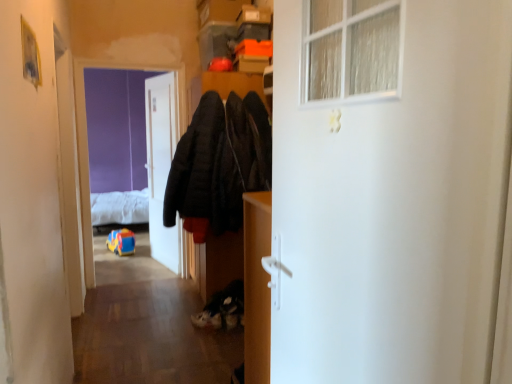
The height and width of the screenshot is (384, 512). Describe the element at coordinates (117, 129) in the screenshot. I see `purple matte screen door at upper left` at that location.

The height and width of the screenshot is (384, 512). I want to click on dark matte coat at center, so click(216, 165).

Locate an element on the screen. This screenshot has height=384, width=512. white glossy door at center, which ranks as the second door in front-to-back order is located at coordinates (161, 167).

What is the approximate width of white matte door at center, which is the first door in right-to-left order?

1.98 inches.

Find the location of a particular element. This screenshot has width=512, height=384. white matte door at center, the first door from the front is located at coordinates (393, 205).

Locate an element on the screen. The image size is (512, 384). wooden floor at lower center is located at coordinates (147, 326).

Is the depth of purple matte screen door at upper left greater than that of white matte door at center, which is the first door in right-to-left order?

Yes, purple matte screen door at upper left is behind white matte door at center, which is the first door in right-to-left order.

Is purple matte screen door at upper left turned away from white matte door at center, the second door from the left?

purple matte screen door at upper left does not have its back to white matte door at center, the second door from the left.

Would you say purple matte screen door at upper left contains white matte door at center, the first door from the front?

Actually, white matte door at center, the first door from the front, is outside purple matte screen door at upper left.

From their relative heights in the image, would you say purple matte screen door at upper left is taller or shorter than white matte door at center, acting as the 2th door starting from the back?

purple matte screen door at upper left is taller than white matte door at center, acting as the 2th door starting from the back.

Does white fluffy bed at upper left contain white glossy door at center, which is the 1th door in left-to-right order?

No, white fluffy bed at upper left does not contain white glossy door at center, which is the 1th door in left-to-right order.

From the image's perspective, is white fluffy bed at upper left on white glossy door at center, which ranks as the 1th door in back-to-front order?

No.

Consider the image. Is white fluffy bed at upper left next to white glossy door at center, which ranks as the 1th door in back-to-front order, and touching it?

white fluffy bed at upper left and white glossy door at center, which ranks as the 1th door in back-to-front order, are clearly separated.

From a real-world perspective, which object rests below the other?

white fluffy bed at upper left is physically lower.

Which object is wider, dark matte coat at center or white fluffy bed at upper left?

Wider between the two is white fluffy bed at upper left.

Which of these two, dark matte coat at center or white fluffy bed at upper left, stands taller?

Standing taller between the two is dark matte coat at center.

Can you tell me how much dark matte coat at center and white fluffy bed at upper left differ in facing direction?

They differ by 1.5 degrees in their facing directions.

From the image's perspective, does wooden floor at lower center appear higher than matte wood cabinet at center?

No, from the image's perspective, wooden floor at lower center is not over matte wood cabinet at center.

The height and width of the screenshot is (384, 512). There is a wooden floor at lower center. What are the coordinates of `cabinetry above it (from a real-world perspective)` in the screenshot? It's located at (257, 287).

How many degrees apart are the facing directions of wooden floor at lower center and matte wood cabinet at center?

The angular difference between wooden floor at lower center and matte wood cabinet at center is 91.7 degrees.

From the picture: Considering the sizes of wooden floor at lower center and matte wood cabinet at center in the image, is wooden floor at lower center bigger or smaller than matte wood cabinet at center?

In the image, wooden floor at lower center appears to be larger than matte wood cabinet at center.

Considering the sizes of objects white suede shoe at lower center and purple matte screen door at upper left in the image provided, who is smaller, white suede shoe at lower center or purple matte screen door at upper left?

With smaller size is white suede shoe at lower center.

Between white suede shoe at lower center and purple matte screen door at upper left, which one has more height?

Standing taller between the two is purple matte screen door at upper left.

Is purple matte screen door at upper left at the back of white suede shoe at lower center?

white suede shoe at lower center is not turned away from purple matte screen door at upper left.

Between white suede shoe at lower center and purple matte screen door at upper left, which one appears on the right side from the viewer's perspective?

From the viewer's perspective, white suede shoe at lower center appears more on the right side.

Considering the relative positions of purple matte screen door at upper left and dark matte coat at center in the image provided, is purple matte screen door at upper left to the right of dark matte coat at center from the viewer's perspective?

In fact, purple matte screen door at upper left is to the left of dark matte coat at center.

Where is `clothing lying on the right of purple matte screen door at upper left`? Image resolution: width=512 pixels, height=384 pixels. clothing lying on the right of purple matte screen door at upper left is located at coordinates (216, 165).

Can you confirm if purple matte screen door at upper left is smaller than dark matte coat at center?

Correct, purple matte screen door at upper left occupies less space than dark matte coat at center.

Considering the sizes of objects purple matte screen door at upper left and matte wood cabinet at center in the image provided, who is wider, purple matte screen door at upper left or matte wood cabinet at center?

purple matte screen door at upper left.

Does purple matte screen door at upper left appear on the left side of matte wood cabinet at center?

Yes, purple matte screen door at upper left is to the left of matte wood cabinet at center.

Measure the distance from purple matte screen door at upper left to matte wood cabinet at center.

purple matte screen door at upper left is 13.02 feet from matte wood cabinet at center.

Where is `screen door below the white matte door at center, which is the first door in right-to-left order (from a real-world perspective)`? screen door below the white matte door at center, which is the first door in right-to-left order (from a real-world perspective) is located at coordinates (117, 129).

From the white fluffy bed at upper left, count 1st door to the right and point to it. Please provide its 2D coordinates.

[(161, 167)]

Estimate the real-world distances between objects in this image. Which object is further from white suede shoe at lower center, white matte door at center, which is the first door in right-to-left order, or matte wood cabinet at center?

white matte door at center, which is the first door in right-to-left order.

Which object lies nearer to the anchor point wooden floor at lower center, white glossy door at center, which ranks as the 1th door in back-to-front order, or matte wood cabinet at center?

white glossy door at center, which ranks as the 1th door in back-to-front order, lies closer to wooden floor at lower center than the other object.

Which object lies further to the anchor point dark matte coat at center, white fluffy bed at upper left or matte wood cabinet at center?

white fluffy bed at upper left.

Looking at the image, which one is located closer to dark matte coat at center, white fluffy bed at upper left or white suede shoe at lower center?

Among the two, white suede shoe at lower center is located nearer to dark matte coat at center.

Based on their spatial positions, is dark matte coat at center or matte wood cabinet at center closer to white suede shoe at lower center?

dark matte coat at center.

When comparing their distances from matte wood cabinet at center, does white matte door at center, the second door from the left, or dark matte coat at center seem further?

dark matte coat at center.

Considering their positions, is matte wood cabinet at center positioned further to white suede shoe at lower center than white glossy door at center, which ranks as the 1th door in back-to-front order?

white glossy door at center, which ranks as the 1th door in back-to-front order, is further to white suede shoe at lower center.

Looking at the image, which one is located closer to white suede shoe at lower center, white matte door at center, acting as the 2th door starting from the back, or purple matte screen door at upper left?

Among the two, white matte door at center, acting as the 2th door starting from the back, is located nearer to white suede shoe at lower center.

At what (x,y) coordinates should I click in order to perform the action: click on screen door positioned between matte wood cabinet at center and white fluffy bed at upper left from near to far. Please return your answer as a coordinate pair (x, y). The width and height of the screenshot is (512, 384). Looking at the image, I should click on (117, 129).

Identify the location of screen door positioned between white matte door at center, the first door from the front, and white glossy door at center, which ranks as the 1th door in back-to-front order, from near to far. (117, 129).

Locate an element on the screen. Image resolution: width=512 pixels, height=384 pixels. clothing located between matte wood cabinet at center and white suede shoe at lower center in the depth direction is located at coordinates (216, 165).

The width and height of the screenshot is (512, 384). I want to click on shoe between wooden floor at lower center and purple matte screen door at upper left along the z-axis, so click(207, 319).